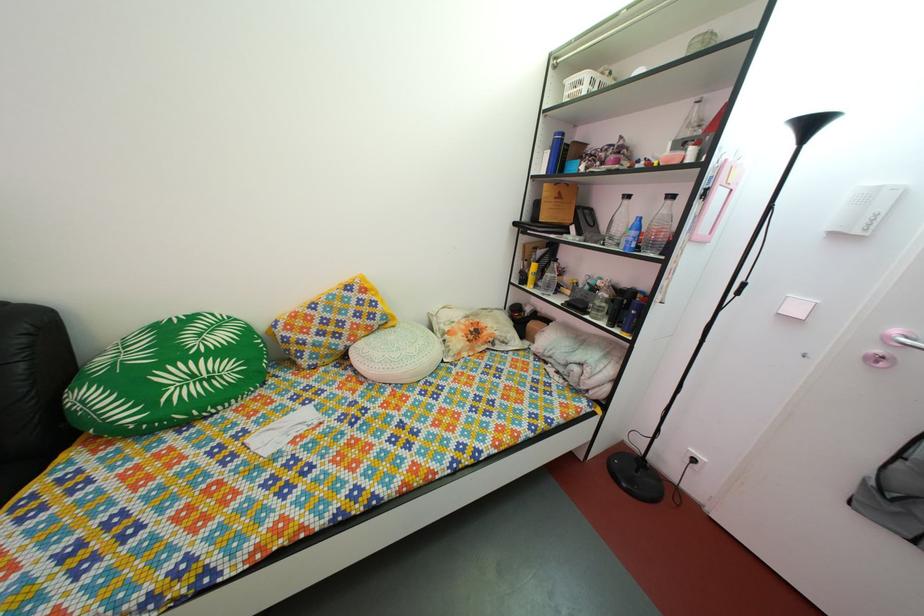
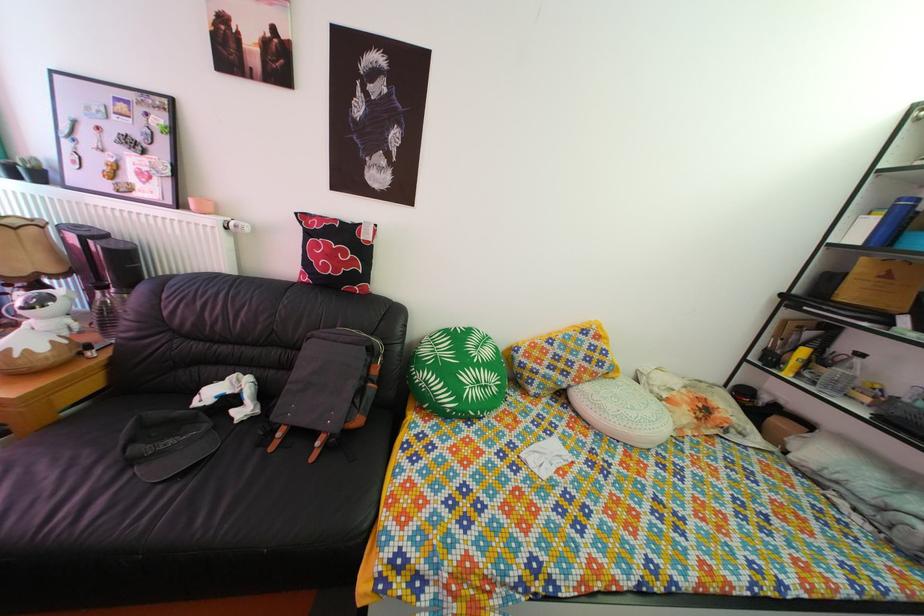
Question: The camera is either moving clockwise (left) or counter-clockwise (right) around the object. The first image is from the beginning of the video and the second image is from the end. Is the camera moving left or right when shooting the video?

Choices:
 (A) Left
 (B) Right

Answer: (B)